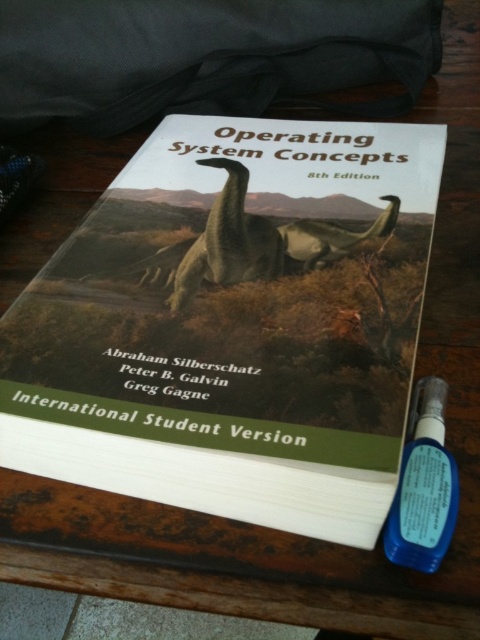
You are holding a measuring tape and want to measure the distance from your eyes to the point marked as point [274,172] in the image. What is the approximate distance in centimeters?

The distance between point [274,172] and the camera is 66.88 centimeters, so the approximate distance from your eyes to the point is 66.88 centimeters.

You are a student trying to organize your desk. You have a hardcover book at center and a green matte dinosaur at center on your desk. Which object should you move first if you want to place them in order from top to bottom?

The green matte dinosaur at center is located above the hardcover book at center, so you should move the green matte dinosaur at center first to place them in order from top to bottom.

You are a student who needs to locate the book with the dinosaur illustration on the cover. The book is placed on a wooden desk. You see a point marked at coordinates [233,324]. Where should you look to find the hardcover book with the dinosaur illustration?

The hardcover book at center is located at point [233,324], so you should look at that point to find the book with the dinosaur illustration.